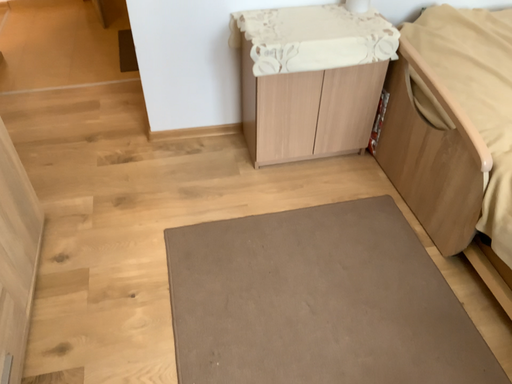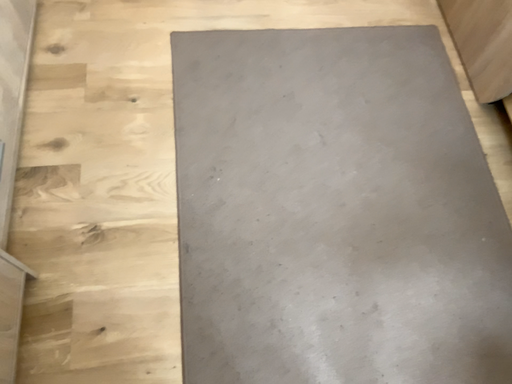
Question: How did the camera likely rotate when shooting the video?

Choices:
 (A) rotated upward
 (B) rotated downward

Answer: (B)